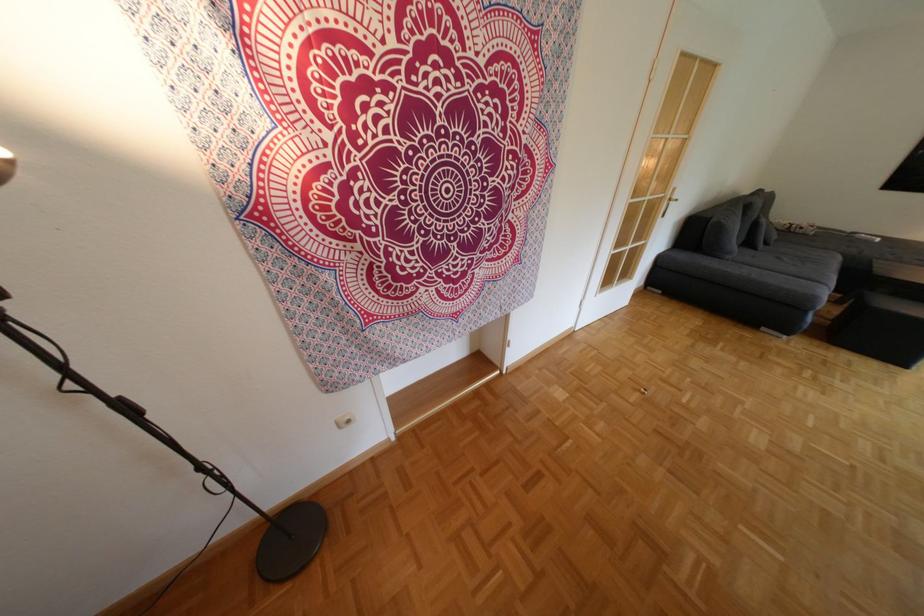
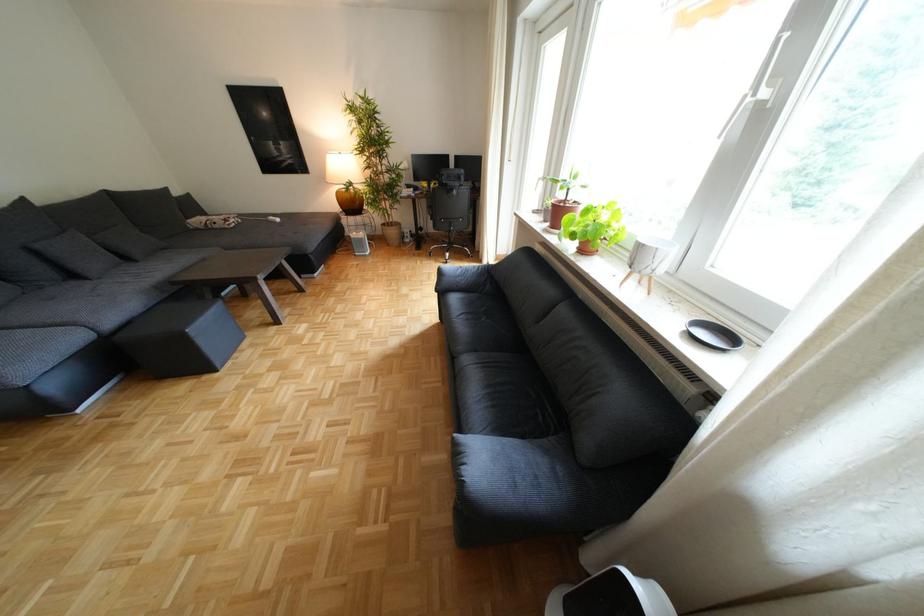
Find the pixel in the second image that matches the point at 768,225 in the first image.

(49, 253)